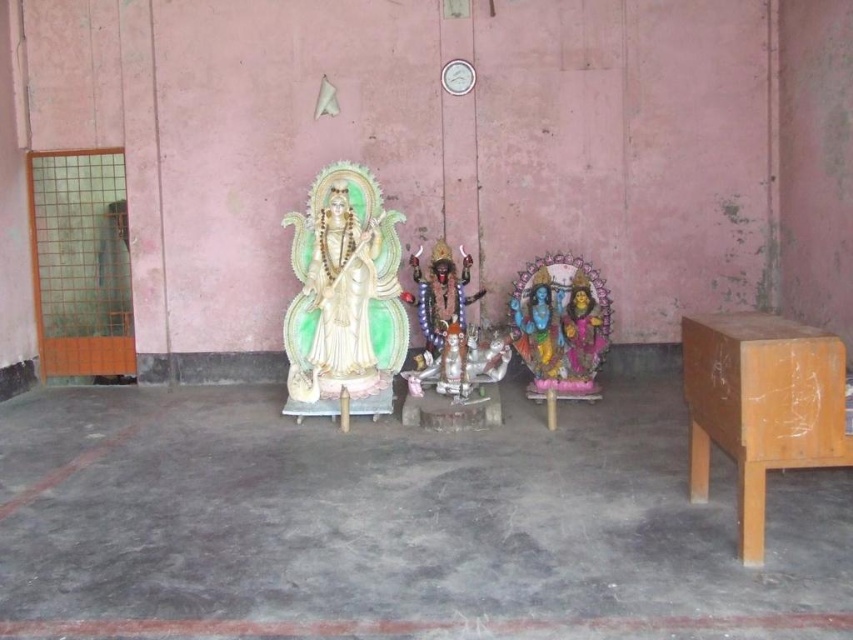
You are standing in the temple room with the pink walls. You see two points marked in the image. The first point is at coordinate [755,525] and the second is at [291,257]. Which point is closer to you from your current position?

Point [755,525] is in front of point [291,257], so the first point is closer to you.

You are organizing a temple event and need to place decorations on the wooden table at right and the ivory glossy statue at center. Which object requires more space for its decorations?

The ivory glossy statue at center requires more space for its decorations because it occupies more space than the wooden table at right.

You are a visitor in this temple and want to place a small offering on the wooden table at right. However, you notice the ivory glossy statue at center is in the way. Can you easily place your offering without moving the statue?

The wooden table at right is not as tall as the ivory glossy statue at center, so the statue might block your view or access to the table. You might need to move around the statue to reach the table and place your offering.